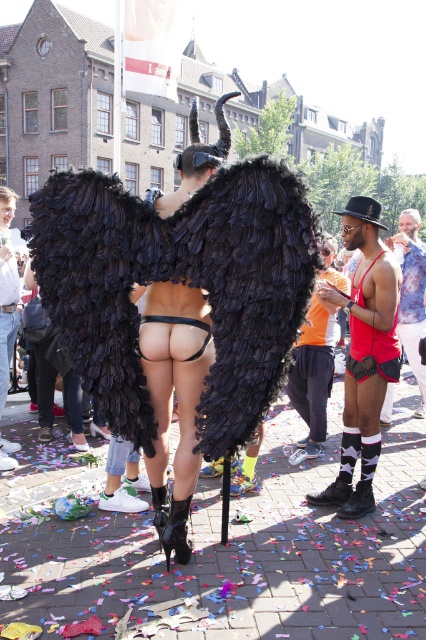
Does shiny red fabric at right come in front of black feathered wings at center?

Yes, shiny red fabric at right is closer to the viewer.

Between shiny red fabric at right and black feathered wings at center, which one appears on the left side from the viewer's perspective?

From the viewer's perspective, black feathered wings at center appears more on the left side.

Who is more forward, (x=420, y=244) or (x=11, y=202)?

Point (x=11, y=202)

Identify the location of shiny red fabric at right. (411, 291).

Which is more to the right, shiny red fabric shorts at center or shiny red fabric at right?

shiny red fabric at right

Measure the distance between point (x=365, y=291) and camera.

5.91 meters

The image size is (426, 640). What do you see at coordinates (363, 353) in the screenshot? I see `shiny red fabric shorts at center` at bounding box center [363, 353].

Locate an element on the screen. The height and width of the screenshot is (640, 426). shiny red fabric shorts at center is located at coordinates (363, 353).

Does shiny red fabric shorts at center have a smaller size compared to reddish-orange tank top at center?

No.

From the picture: Does shiny red fabric shorts at center have a larger size compared to reddish-orange tank top at center?

Correct, shiny red fabric shorts at center is larger in size than reddish-orange tank top at center.

Which is in front, point (351, 240) or point (310, 352)?

Point (351, 240) is in front.

The height and width of the screenshot is (640, 426). Find the location of `shiny red fabric shorts at center`. shiny red fabric shorts at center is located at coordinates (363, 353).